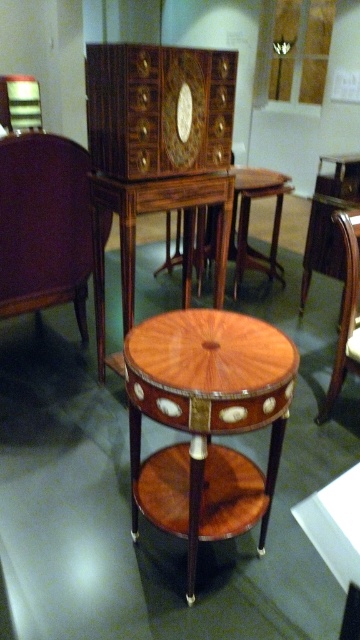
Question: Is mahogany wood side table at center further to camera compared to mahogany wood chair at center?

Choices:
 (A) yes
 (B) no

Answer: (A)

Question: Estimate the real-world distances between objects in this image. Which object is closer to the mahogany wood table at center?

Choices:
 (A) mahogany wood chair at center
 (B) mahogany veneer drawer at center

Answer: (A)

Question: Which object is closer to the camera taking this photo?

Choices:
 (A) mahogany veneer drawer at center
 (B) mahogany wood table at center
 (C) mahogany veneer round table at center
 (D) mahogany wood side table at center

Answer: (A)

Question: Can you confirm if mahogany veneer round table at center is positioned below mahogany wood table at center?

Choices:
 (A) yes
 (B) no

Answer: (A)

Question: Which of these objects is positioned closest to the mahogany veneer round table at center?

Choices:
 (A) mahogany wood table at center
 (B) mahogany wood chair at center
 (C) mahogany veneer drawer at center
 (D) mahogany wood side table at center

Answer: (C)

Question: Is mahogany veneer drawer at center positioned at the back of mahogany wood chair at center?

Choices:
 (A) yes
 (B) no

Answer: (B)